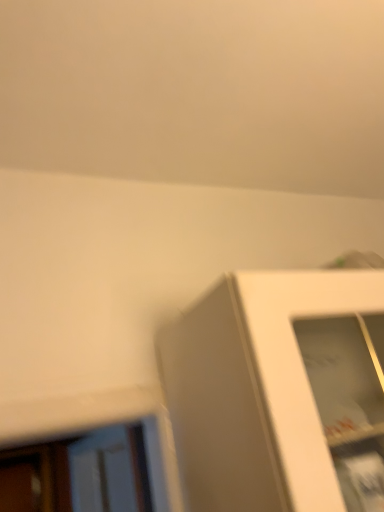
Identify the location of white matte cabinet at lower right. (279, 392).

What do you see at coordinates (279, 392) in the screenshot? The width and height of the screenshot is (384, 512). I see `white matte cabinet at lower right` at bounding box center [279, 392].

Where is `white matte cabinet at lower right`? The height and width of the screenshot is (512, 384). white matte cabinet at lower right is located at coordinates (279, 392).